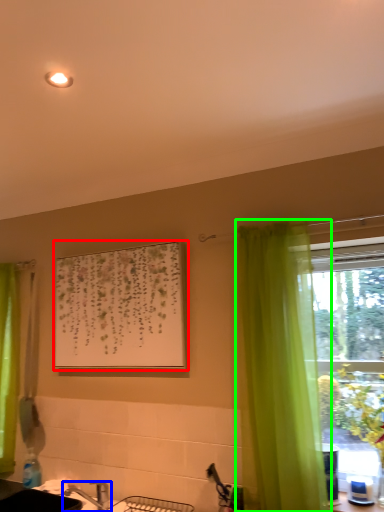
Question: Which object is positioned closest to picture frame (highlighted by a red box)? Select from tap (highlighted by a blue box) and curtain (highlighted by a green box).

Choices:
 (A) tap
 (B) curtain

Answer: (B)